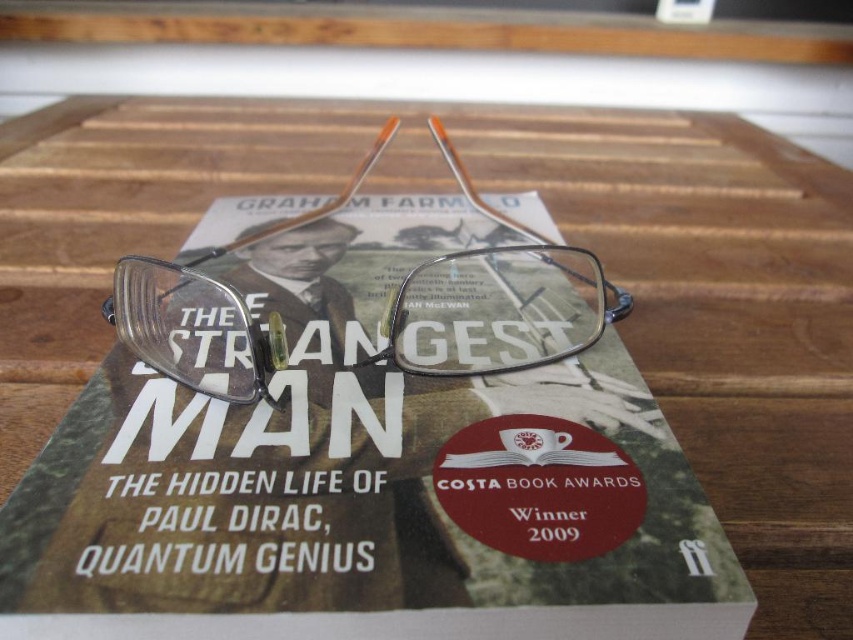
You are a librarian organizing books on a shelf. You notice the matte green book at center and the clear plastic glasses at center on the table. Which item should you place on the shelf first according to their positions?

The matte green book at center is in front of the clear plastic glasses at center, so you should place the clear plastic glasses at center first before the matte green book at center to maintain their original arrangement.

You are a student who just found the matte green book at center and clear plastic glasses at center on a desk. You want to place the glasses back on top of the book. Are the glasses currently positioned to the left or right of the book?

The matte green book at center is to the right of the clear plastic glasses at center, so the glasses are currently to the left of the book.